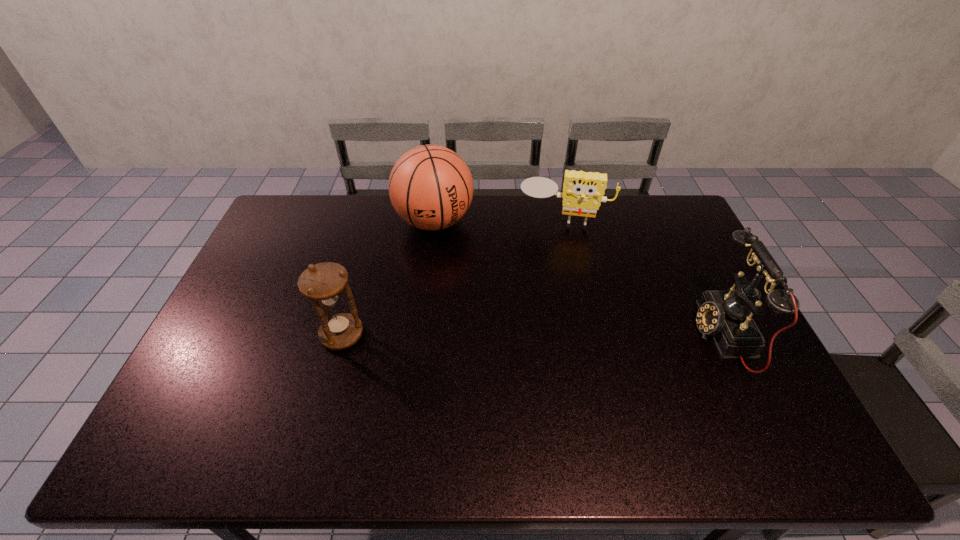
Identify the location of free space on the desktop that is between the leftmost object and the telephone and is positioned on the front-facing side of the third object from left to right. The height and width of the screenshot is (540, 960). (554, 335).

Find the location of a particular element. The image size is (960, 540). vacant space on the desktop that is between the hourglass and the rightmost object and is positioned on the surface of the third object from right to left near the brand logo is located at coordinates (481, 335).